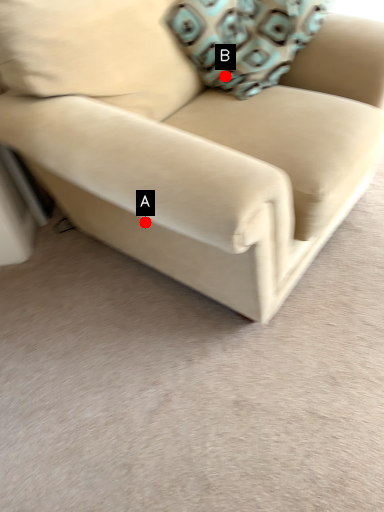
Question: Two points are circled on the image, labeled by A and B beside each circle. Which point is closer to the camera?

Choices:
 (A) A is closer
 (B) B is closer

Answer: (A)